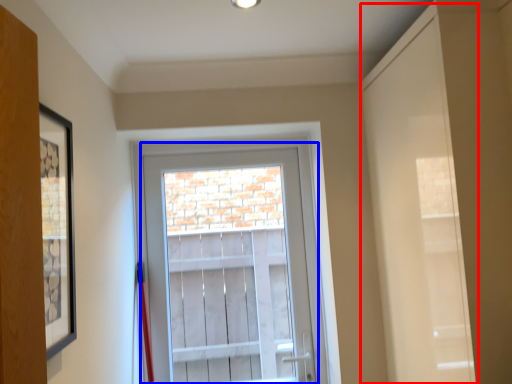
Question: Among these objects, which one is farthest to the camera, door (highlighted by a red box) or glass door (highlighted by a blue box)?

Choices:
 (A) door
 (B) glass door

Answer: (B)